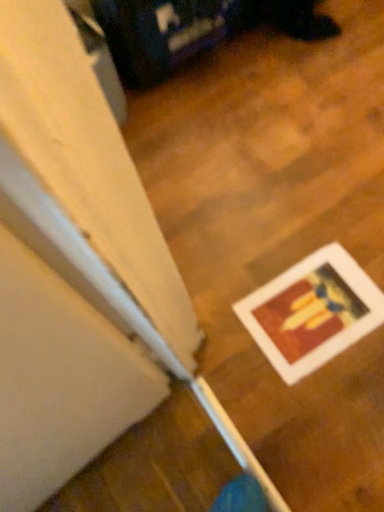
Question: In terms of height, does white matte picture frame at lower right look taller or shorter compared to wooden floor at lower right?

Choices:
 (A) tall
 (B) short

Answer: (A)

Question: Choose the correct answer: Is white matte picture frame at lower right inside wooden floor at lower right or outside it?

Choices:
 (A) outside
 (B) inside

Answer: (B)

Question: Considering the positions of point (340, 297) and point (119, 463), is point (340, 297) closer or farther from the camera than point (119, 463)?

Choices:
 (A) closer
 (B) farther

Answer: (B)

Question: In terms of height, does wooden floor at lower right look taller or shorter compared to white matte picture frame at lower right?

Choices:
 (A) short
 (B) tall

Answer: (A)

Question: Looking at their shapes, would you say wooden floor at lower right is wider or thinner than white matte picture frame at lower right?

Choices:
 (A) thin
 (B) wide

Answer: (B)

Question: In the image, is wooden floor at lower right on the left side or the right side of white matte picture frame at lower right?

Choices:
 (A) right
 (B) left

Answer: (B)

Question: From a real-world perspective, is wooden floor at lower right above or below white matte picture frame at lower right?

Choices:
 (A) above
 (B) below

Answer: (B)